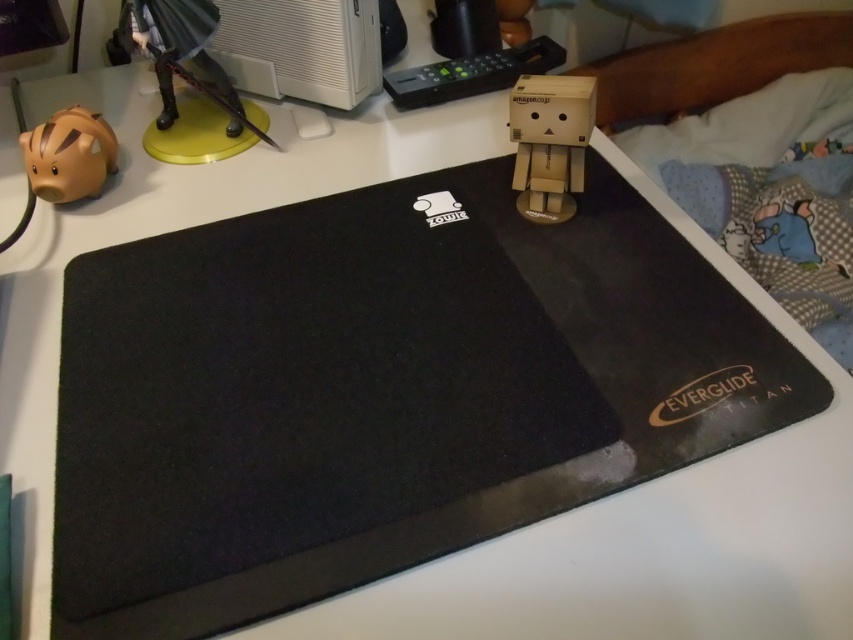
What is located at point [717,65] in the desk setup?

The black fabric bed is located at point [717,65].

You are organizing a desk and need to place a new item between the black fabric bed at upper right and the cardboard figure at center. Based on their positions, where should you place the new item?

The new item should be placed between the black fabric bed at upper right and the cardboard figure at center, which are vertically aligned with the bed above and the figure below.